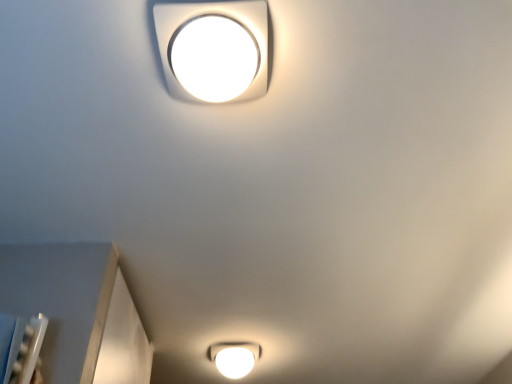
Question: Does white glossy square lamp at upper center, the 1th lamp viewed from the top, come in front of white glossy light fixture at bottom, which is the first lamp from bottom to top?

Choices:
 (A) no
 (B) yes

Answer: (B)

Question: From a real-world perspective, is white glossy square lamp at upper center, the second lamp when ordered from back to front, beneath white glossy light fixture at bottom, placed as the 1th lamp when sorted from back to front?

Choices:
 (A) no
 (B) yes

Answer: (B)

Question: Does white glossy square lamp at upper center, the first lamp when ordered from front to back, have a larger size compared to white glossy light fixture at bottom, which is the first lamp from bottom to top?

Choices:
 (A) no
 (B) yes

Answer: (A)

Question: Does white glossy square lamp at upper center, the second lamp when ordered from back to front, appear on the right side of white glossy light fixture at bottom, which is the 2th lamp from front to back?

Choices:
 (A) yes
 (B) no

Answer: (A)

Question: Can you confirm if white glossy square lamp at upper center, the 1th lamp viewed from the top, is shorter than white glossy light fixture at bottom, acting as the second lamp starting from the top?

Choices:
 (A) no
 (B) yes

Answer: (B)

Question: From the image's perspective, is white glossy square lamp at upper center, the 1th lamp viewed from the top, located above white glossy light fixture at bottom, which is the first lamp from bottom to top?

Choices:
 (A) yes
 (B) no

Answer: (A)

Question: Considering the relative sizes of white glossy light fixture at bottom, which is the 2th lamp from front to back, and white glossy square lamp at upper center, the second lamp from the bottom, in the image provided, is white glossy light fixture at bottom, which is the 2th lamp from front to back, shorter than white glossy square lamp at upper center, the second lamp from the bottom,?

Choices:
 (A) no
 (B) yes

Answer: (A)

Question: From a real-world perspective, is white glossy light fixture at bottom, placed as the 1th lamp when sorted from back to front, below white glossy square lamp at upper center, the second lamp from the bottom?

Choices:
 (A) no
 (B) yes

Answer: (A)

Question: From the image's perspective, would you say white glossy light fixture at bottom, placed as the 1th lamp when sorted from back to front, is positioned over white glossy square lamp at upper center, the first lamp when ordered from front to back?

Choices:
 (A) yes
 (B) no

Answer: (B)

Question: Is white glossy light fixture at bottom, which is the 2th lamp from front to back, positioned beyond the bounds of white glossy square lamp at upper center, the second lamp when ordered from back to front?

Choices:
 (A) yes
 (B) no

Answer: (A)

Question: Is white glossy light fixture at bottom, which is the 2th lamp from front to back, at the right side of white glossy square lamp at upper center, the 1th lamp viewed from the top?

Choices:
 (A) no
 (B) yes

Answer: (A)

Question: Can you confirm if white glossy light fixture at bottom, which is the 2th lamp from front to back, is wider than white glossy square lamp at upper center, the second lamp from the bottom?

Choices:
 (A) yes
 (B) no

Answer: (A)

Question: From a real-world perspective, is white glossy square lamp at upper center, the 1th lamp viewed from the top, physically located above or below white glossy light fixture at bottom, which is the 2th lamp from front to back?

Choices:
 (A) below
 (B) above

Answer: (A)